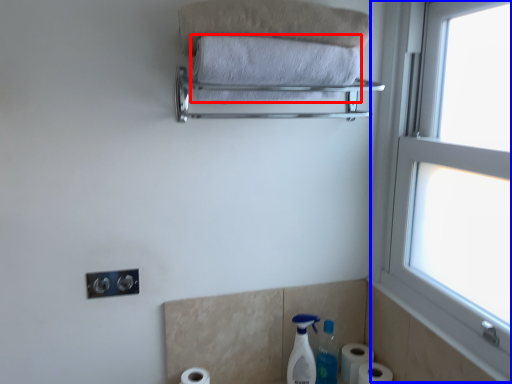
Question: Which point is further to the camera, towel (highlighted by a red box) or window (highlighted by a blue box)?

Choices:
 (A) towel
 (B) window

Answer: (A)